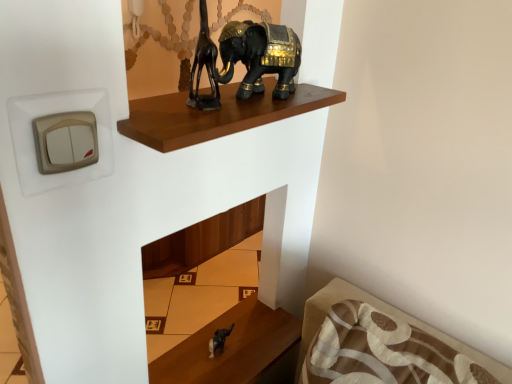
This screenshot has width=512, height=384. In order to click on empty space that is ontop of brown polished wood shelf at upper center (from a real-world perspective) in this screenshot , I will do `click(248, 105)`.